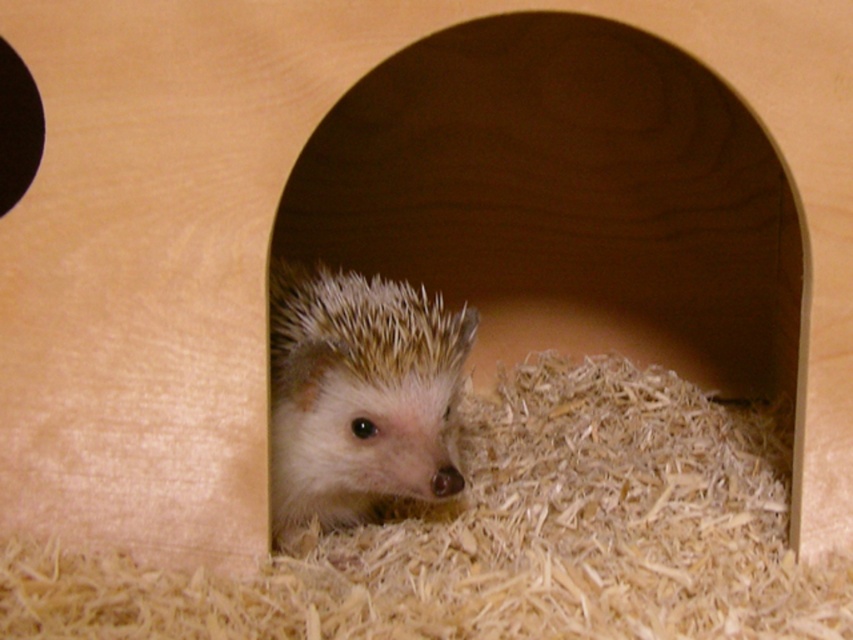
Is light brown shredded wood at center taller than white spiny hedgehog at center?

No.

Looking at this image, can you confirm if light brown shredded wood at center is positioned to the left of white spiny hedgehog at center?

In fact, light brown shredded wood at center is to the right of white spiny hedgehog at center.

What do you see at coordinates (508, 538) in the screenshot?
I see `light brown shredded wood at center` at bounding box center [508, 538].

Identify the location of light brown shredded wood at center. (508, 538).

Is white spiny hedgehog at center taller than black matte hole at upper left?

Yes, white spiny hedgehog at center is taller than black matte hole at upper left.

Can you confirm if white spiny hedgehog at center is smaller than black matte hole at upper left?

No.

Which is behind, point (355, 344) or point (4, 140)?

Point (4, 140)

Where is `white spiny hedgehog at center`? This screenshot has height=640, width=853. white spiny hedgehog at center is located at coordinates (360, 394).

Is light brown shredded wood at center smaller than black matte hole at upper left?

No.

Image resolution: width=853 pixels, height=640 pixels. Find the location of `light brown shredded wood at center`. light brown shredded wood at center is located at coordinates [x=508, y=538].

Where is `light brown shredded wood at center`? light brown shredded wood at center is located at coordinates (508, 538).